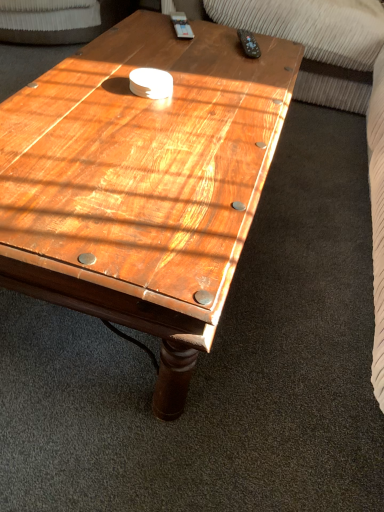
Question: Considering their positions, is black plastic remote at upper right located in front of or behind wooden coffee table at center?

Choices:
 (A) behind
 (B) front

Answer: (A)

Question: Looking at their shapes, would you say black plastic remote at upper right is wider or thinner than wooden coffee table at center?

Choices:
 (A) wide
 (B) thin

Answer: (B)

Question: Would you say black plastic remote at upper right is inside or outside wooden coffee table at center?

Choices:
 (A) inside
 (B) outside

Answer: (A)

Question: From their relative heights in the image, would you say wooden coffee table at center is taller or shorter than black plastic remote at upper right?

Choices:
 (A) tall
 (B) short

Answer: (A)

Question: Is wooden coffee table at center inside or outside of black plastic remote at upper right?

Choices:
 (A) outside
 (B) inside

Answer: (A)

Question: Considering the positions of point (241, 199) and point (246, 36), is point (241, 199) closer or farther from the camera than point (246, 36)?

Choices:
 (A) farther
 (B) closer

Answer: (B)

Question: From the image's perspective, is wooden coffee table at center above or below black plastic remote at upper right?

Choices:
 (A) above
 (B) below

Answer: (B)